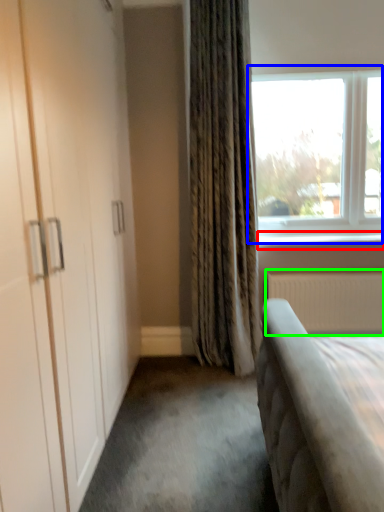
Question: Estimate the real-world distances between objects in this image. Which object is farther from window sill (highlighted by a red box), window (highlighted by a blue box) or radiator (highlighted by a green box)?

Choices:
 (A) window
 (B) radiator

Answer: (A)